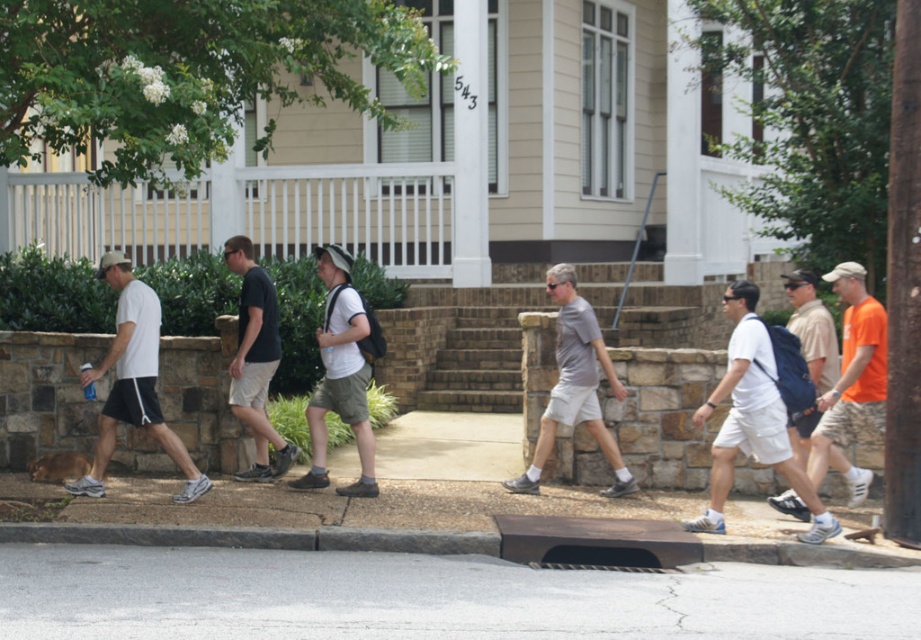
Question: Which object is farther from the camera taking this photo?

Choices:
 (A) white cotton t-shirt at center
 (B) orange cotton t-shirt at right

Answer: (B)

Question: Among these objects, which one is nearest to the camera?

Choices:
 (A) orange cotton t-shirt at right
 (B) asphalt at lower center

Answer: (B)

Question: Is asphalt at lower center above gray matte shorts at center?

Choices:
 (A) no
 (B) yes

Answer: (A)

Question: Can you confirm if gray matte shorts at center is positioned below black cotton shirt at center?

Choices:
 (A) yes
 (B) no

Answer: (A)

Question: Which object is closer to the camera taking this photo?

Choices:
 (A) asphalt at lower center
 (B) white matte t-shirt at center

Answer: (A)

Question: Does white cotton t-shirt at center have a greater width compared to black cotton shirt at center?

Choices:
 (A) yes
 (B) no

Answer: (A)